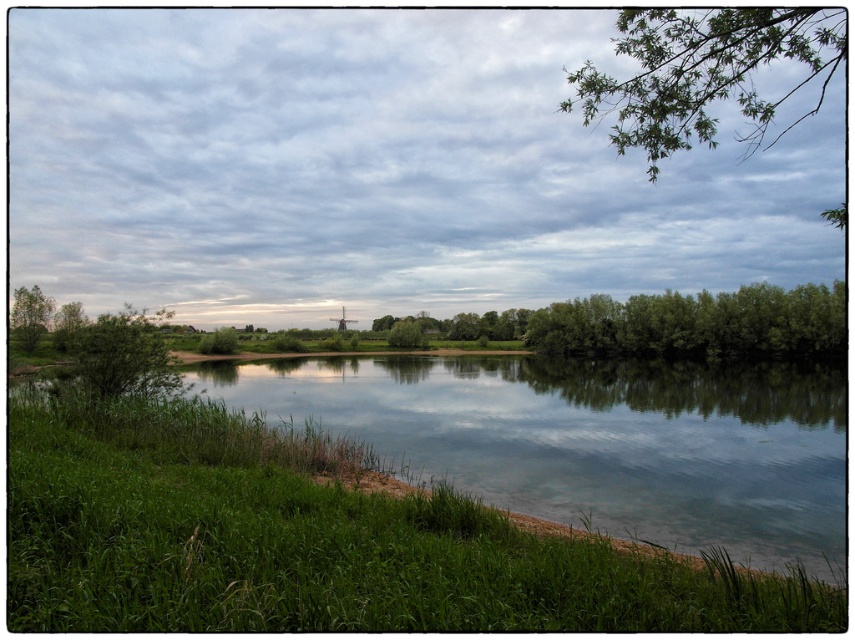
Does green grass at lower left have a lesser width compared to green leafy tree at left?

Indeed, green grass at lower left has a lesser width compared to green leafy tree at left.

The height and width of the screenshot is (640, 855). What do you see at coordinates (320, 540) in the screenshot?
I see `green grass at lower left` at bounding box center [320, 540].

Image resolution: width=855 pixels, height=640 pixels. What are the coordinates of `green grass at lower left` in the screenshot? It's located at (320, 540).

Is green leafy bush at left positioned in front of green leafy tree at left?

Yes, it is in front of green leafy tree at left.

From the picture: Does green leafy bush at left have a smaller size compared to green leafy tree at left?

Yes.

I want to click on green leafy bush at left, so click(121, 356).

Can you confirm if green leafy trees at center is positioned to the right of green leafy tree at center?

Indeed, green leafy trees at center is positioned on the right side of green leafy tree at center.

Is green leafy trees at center positioned at the back of green leafy tree at center?

No, green leafy trees at center is closer to the viewer.

What do you see at coordinates (671, 323) in the screenshot? This screenshot has width=855, height=640. I see `green leafy trees at center` at bounding box center [671, 323].

Identify the location of green leafy trees at center. (671, 323).